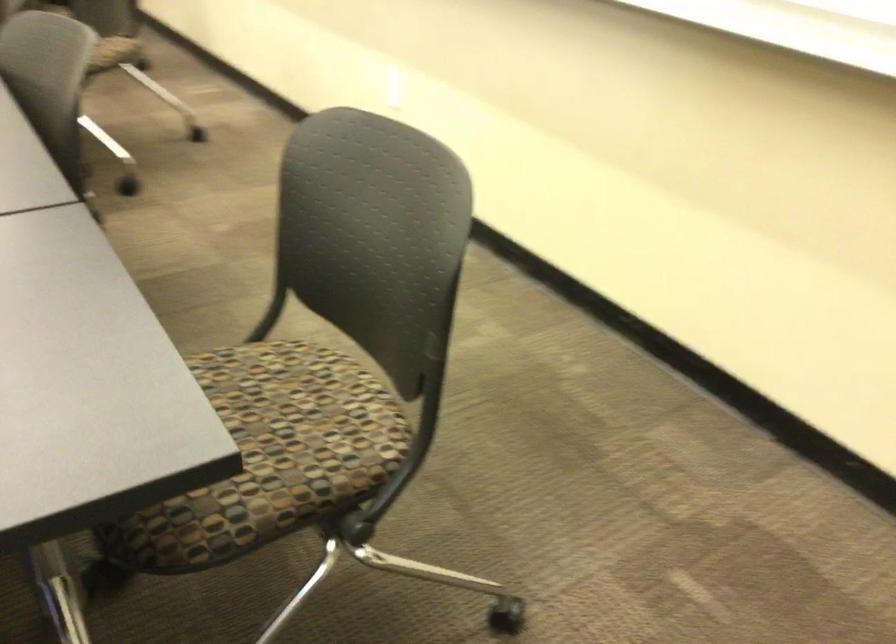
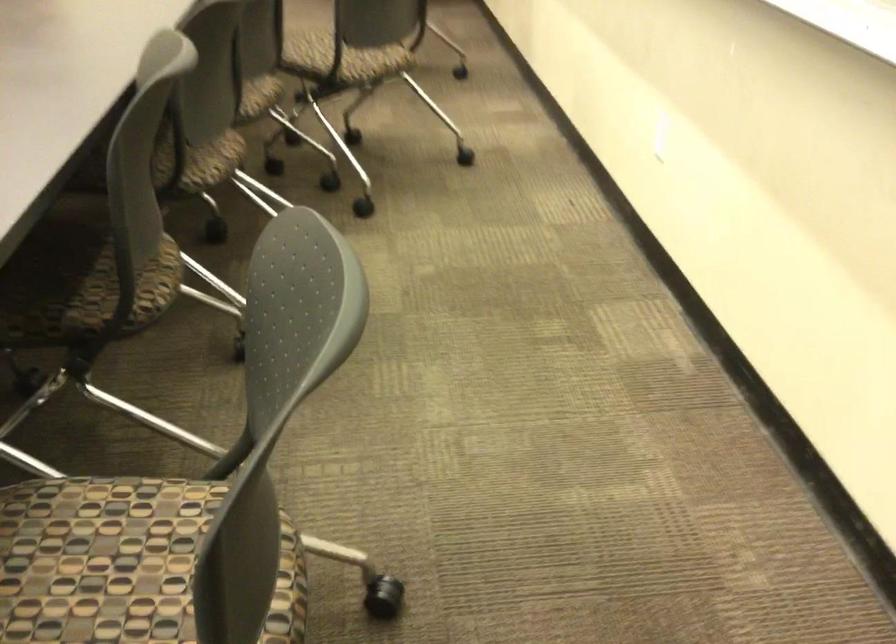
Question: The images are taken continuously from a first-person perspective. In which direction is your viewpoint rotating?

Choices:
 (A) Left
 (B) Right
 (C) Up
 (D) Down

Answer: (A)